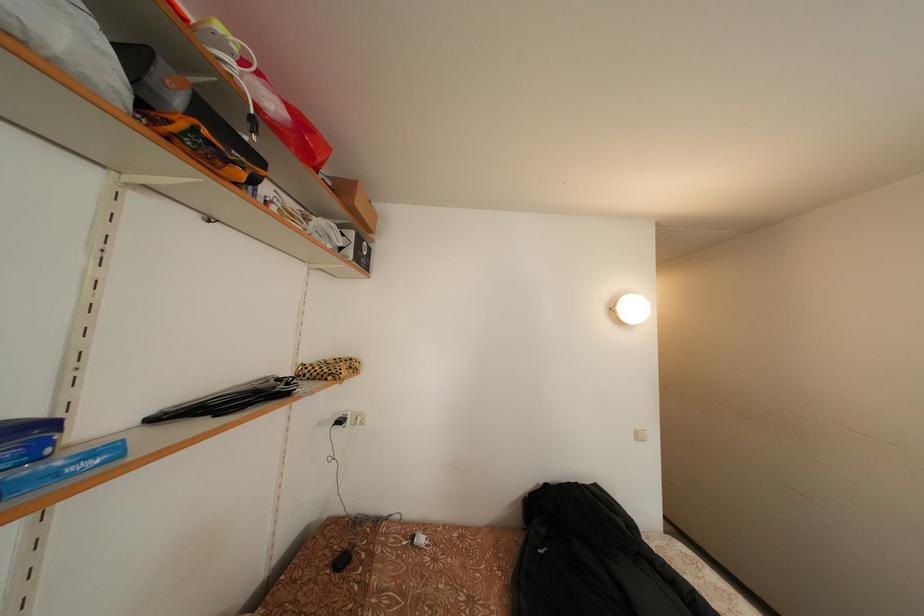
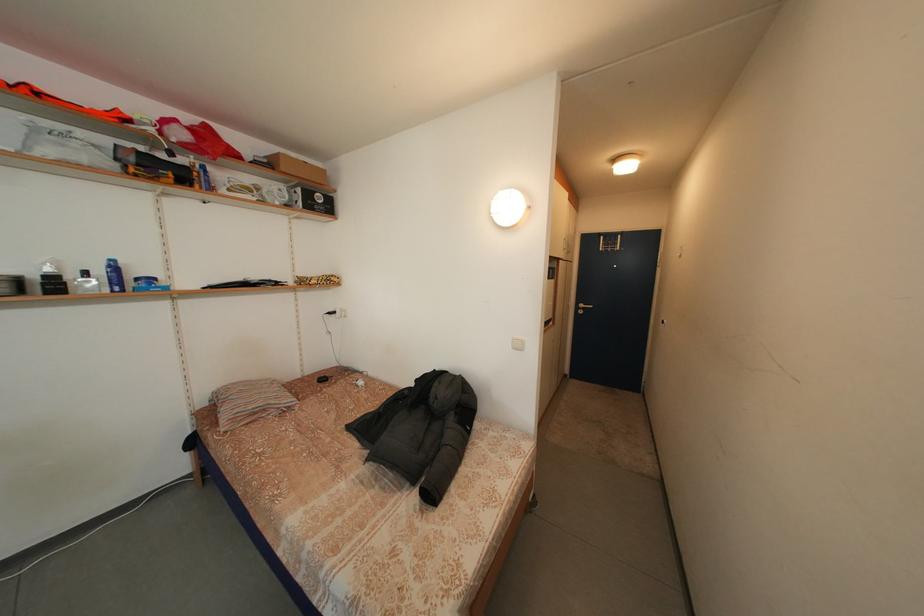
In the second image, find the point that corresponds to point 359,238 in the first image.

(307, 196)